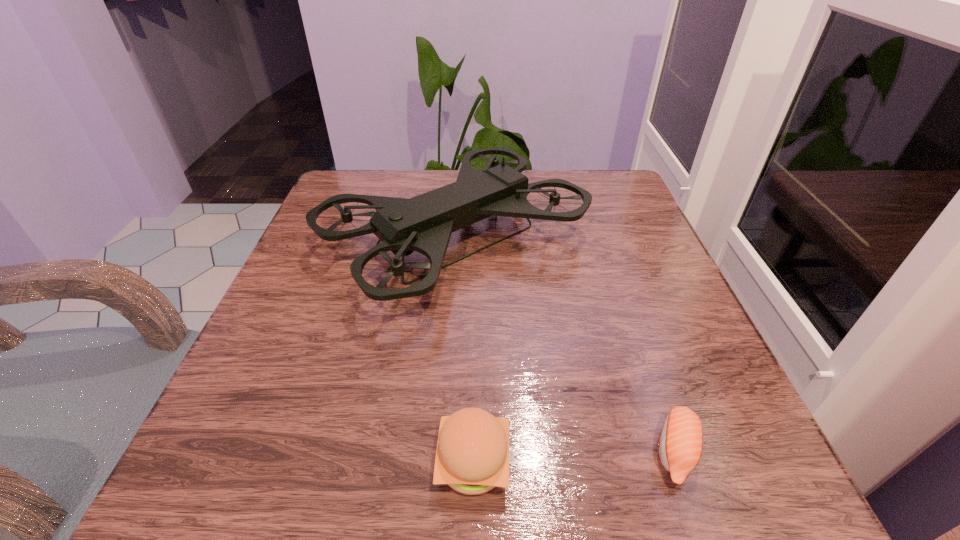
Locate an element on the screen. The height and width of the screenshot is (540, 960). free area in between the drone and the shortest object is located at coordinates [565, 346].

Locate an element on the screen. vacant area between the tallest object and the second shortest object is located at coordinates (464, 351).

Locate which object is the second closest to the tallest object. Please provide its 2D coordinates. Your answer should be formatted as a tuple, i.e. [(x, y)], where the tuple contains the x and y coordinates of a point satisfying the conditions above.

[(472, 456)]

Identify the location of object that is the closest to the shortest object. tap(424, 223).

In order to click on vacant space that satisfies the following two spatial constraints: 1. on the front side of the shortest object; 2. on the left side of the tallest object in this screenshot , I will do `click(440, 451)`.